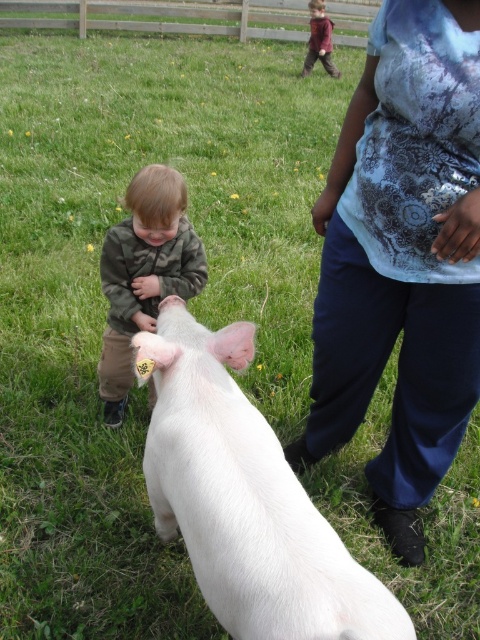
Question: Is white smooth pig at center closer to the viewer compared to camouflage jacket at center?

Choices:
 (A) yes
 (B) no

Answer: (A)

Question: Considering the real-world distances, which object is closest to the maroon sweater at upper right?

Choices:
 (A) camouflage jacket at center
 (B) white smooth pig at center

Answer: (A)

Question: Can you confirm if white smooth pig at center is smaller than maroon sweater at upper right?

Choices:
 (A) yes
 (B) no

Answer: (A)

Question: Is blue tie-dye shirt at center closer to the viewer compared to maroon sweater at upper right?

Choices:
 (A) yes
 (B) no

Answer: (A)

Question: Which object is farther from the camera taking this photo?

Choices:
 (A) blue tie-dye shirt at center
 (B) camouflage jacket at center

Answer: (B)

Question: Which of these objects is positioned farthest from the blue tie-dye shirt at center?

Choices:
 (A) camouflage jacket at center
 (B) white smooth pig at center

Answer: (A)